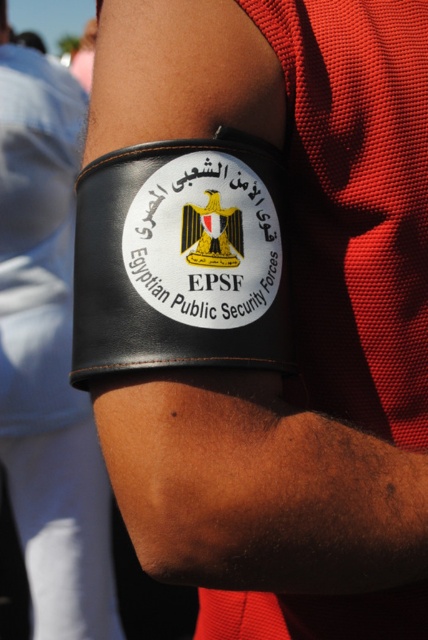
Question: Is black leather armband at center behind black leather patch at upper center?

Choices:
 (A) yes
 (B) no

Answer: (A)

Question: Is the position of black leather armband at center more distant than that of black leather patch at center?

Choices:
 (A) yes
 (B) no

Answer: (A)

Question: Which of these objects is positioned closest to the black leather armband at center?

Choices:
 (A) black leather patch at center
 (B) black leather patch at upper center

Answer: (A)

Question: Which point is farther to the camera?

Choices:
 (A) (17, 157)
 (B) (202, 198)

Answer: (A)

Question: Does black leather patch at center have a smaller size compared to black leather patch at upper center?

Choices:
 (A) yes
 (B) no

Answer: (B)

Question: Which of these objects is positioned farthest from the black leather patch at center?

Choices:
 (A) black leather armband at center
 (B) black leather patch at upper center

Answer: (A)